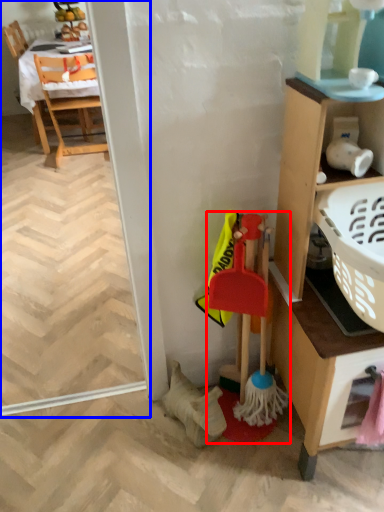
Question: Which object appears farthest to the camera in this image, toy (highlighted by a red box) or screen door (highlighted by a blue box)?

Choices:
 (A) toy
 (B) screen door

Answer: (B)